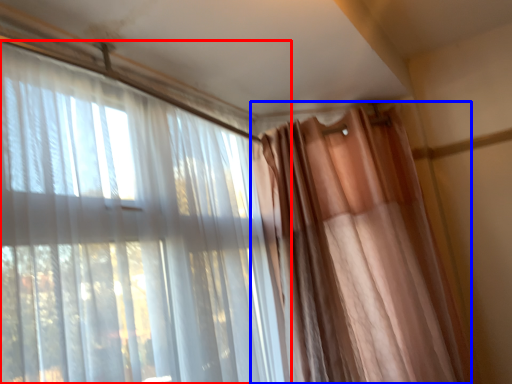
Question: Among these objects, which one is nearest to the camera, curtain (highlighted by a red box) or curtain (highlighted by a blue box)?

Choices:
 (A) curtain
 (B) curtain

Answer: (A)